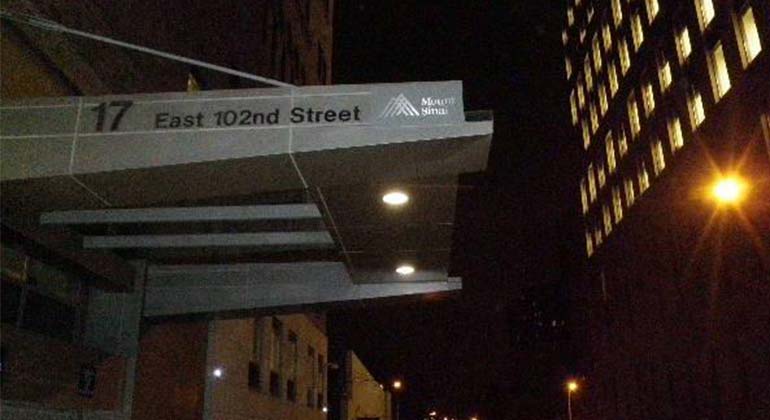
You are a GUI agent. You are given a task and a screenshot of the screen. Output one action in this format:
    pyautogui.click(x=<x>, y=<y>)
    Task: Click on the light
    
    Given the screenshot: What is the action you would take?
    pyautogui.click(x=741, y=185)